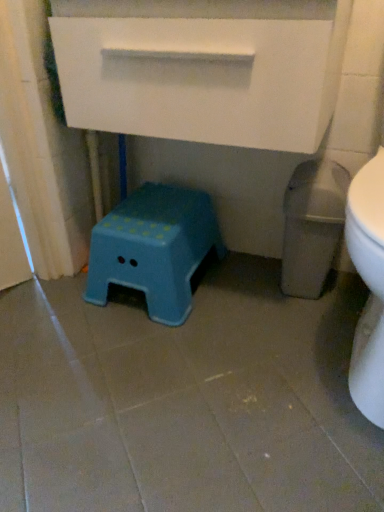
Image resolution: width=384 pixels, height=512 pixels. Identify the location of blue plastic stool at lower left. (154, 248).

What do you see at coordinates (154, 248) in the screenshot?
I see `blue plastic stool at lower left` at bounding box center [154, 248].

In order to face white matte drawer at upper center, should I rotate leftwards or rightwards?

You should rotate right by 1.937 degrees.

The width and height of the screenshot is (384, 512). I want to click on white matte drawer at upper center, so click(x=200, y=78).

The width and height of the screenshot is (384, 512). What do you see at coordinates (200, 78) in the screenshot? I see `white matte drawer at upper center` at bounding box center [200, 78].

In order to click on blue plastic stool at lower left in this screenshot , I will do `click(154, 248)`.

Considering the positions of objects blue plastic stool at lower left and white matte drawer at upper center in the image provided, who is more to the left, blue plastic stool at lower left or white matte drawer at upper center?

blue plastic stool at lower left.

Which object is more forward, blue plastic stool at lower left or white matte drawer at upper center?

white matte drawer at upper center.

Which is farther, (x=105, y=256) or (x=251, y=137)?

The point (x=105, y=256) is more distant.

From the image's perspective, is blue plastic stool at lower left beneath white matte drawer at upper center?

Indeed, from the image's perspective, blue plastic stool at lower left is shown beneath white matte drawer at upper center.

From a real-world perspective, is blue plastic stool at lower left on white matte drawer at upper center?

No, from a real-world perspective, blue plastic stool at lower left is not over white matte drawer at upper center

Between blue plastic stool at lower left and white matte drawer at upper center, which one has smaller width?

With smaller width is blue plastic stool at lower left.

Considering the relative sizes of blue plastic stool at lower left and white matte drawer at upper center in the image provided, is blue plastic stool at lower left taller than white matte drawer at upper center?

No.

Considering the sizes of objects blue plastic stool at lower left and white matte drawer at upper center in the image provided, who is smaller, blue plastic stool at lower left or white matte drawer at upper center?

blue plastic stool at lower left.

In the scene shown: Which is correct: blue plastic stool at lower left is inside white matte drawer at upper center, or outside of it?

The correct answer is: outside.

Would you say blue plastic stool at lower left is a long distance from white matte drawer at upper center?

No, blue plastic stool at lower left is in close proximity to white matte drawer at upper center.

Does blue plastic stool at lower left turn towards white matte drawer at upper center?

No, blue plastic stool at lower left is not turned towards white matte drawer at upper center.

Find the location of a particular element. stool located on the left of white matte drawer at upper center is located at coordinates (154, 248).

Considering the relative positions of white matte drawer at upper center and blue plastic stool at lower left in the image provided, is white matte drawer at upper center to the left or to the right of blue plastic stool at lower left?

white matte drawer at upper center is to the right of blue plastic stool at lower left.

Is white matte drawer at upper center closer to the viewer compared to blue plastic stool at lower left?

Yes.

Does point (319, 55) lie in front of point (138, 285)?

Yes, point (319, 55) is in front of point (138, 285).

From the image's perspective, which one is positioned higher, white matte drawer at upper center or blue plastic stool at lower left?

white matte drawer at upper center is shown above in the image.

From a real-world perspective, which is physically below, white matte drawer at upper center or blue plastic stool at lower left?

blue plastic stool at lower left.

Between white matte drawer at upper center and blue plastic stool at lower left, which one has larger width?

white matte drawer at upper center.

Does white matte drawer at upper center have a greater height compared to blue plastic stool at lower left?

Correct, white matte drawer at upper center is much taller as blue plastic stool at lower left.

Considering the sizes of objects white matte drawer at upper center and blue plastic stool at lower left in the image provided, who is smaller, white matte drawer at upper center or blue plastic stool at lower left?

blue plastic stool at lower left.

Is white matte drawer at upper center spatially inside blue plastic stool at lower left, or outside of it?

white matte drawer at upper center is not enclosed by blue plastic stool at lower left.

Looking at this image, does white matte drawer at upper center touch blue plastic stool at lower left?

white matte drawer at upper center and blue plastic stool at lower left are clearly separated.

Is white matte drawer at upper center facing away from blue plastic stool at lower left?

white matte drawer at upper center does not have its back to blue plastic stool at lower left.

Measure the distance between white matte drawer at upper center and blue plastic stool at lower left.

white matte drawer at upper center is 15.72 inches from blue plastic stool at lower left.

Locate an element on the screen. drawer that appears above the blue plastic stool at lower left (from a real-world perspective) is located at coordinates (200, 78).

This screenshot has height=512, width=384. I want to click on stool that appears on the left of white matte drawer at upper center, so click(154, 248).

Where is `stool behind the white matte drawer at upper center`? This screenshot has width=384, height=512. stool behind the white matte drawer at upper center is located at coordinates (154, 248).